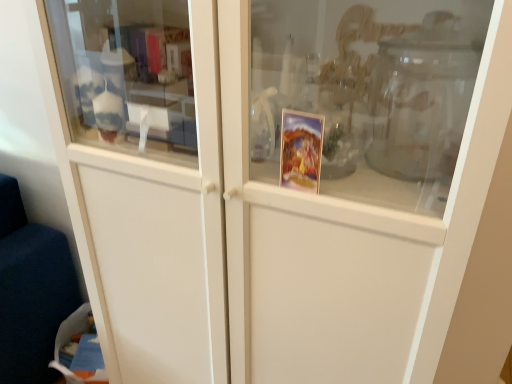
The height and width of the screenshot is (384, 512). I want to click on white cardboard box at lower left, so click(69, 338).

This screenshot has height=384, width=512. Describe the element at coordinates (69, 338) in the screenshot. I see `white cardboard box at lower left` at that location.

In order to click on white cardboard box at lower left in this screenshot , I will do `click(69, 338)`.